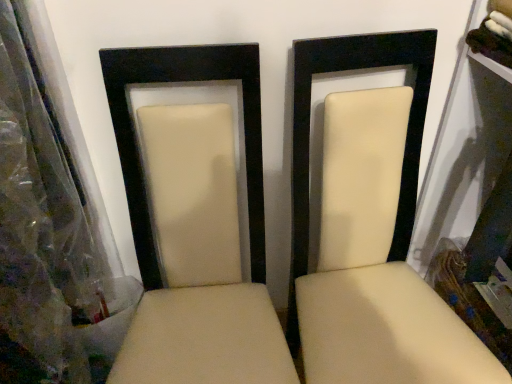
Find the location of a particular element. This screenshot has height=384, width=512. beige leather chair at center, positioned as the second chair in left-to-right order is located at coordinates [x=370, y=230].

How much space does beige leather chair at center, which ranks as the 1th chair in right-to-left order, occupy vertically?

It is 3.52 feet.

This screenshot has height=384, width=512. What do you see at coordinates (370, 230) in the screenshot? I see `beige leather chair at center, which ranks as the 1th chair in right-to-left order` at bounding box center [370, 230].

This screenshot has width=512, height=384. In order to click on beige leather chair at center, which is the second chair from right to left in this screenshot , I will do `click(194, 225)`.

What is the approximate width of beige leather chair at center, which is the second chair from right to left?

It is 22.85 inches.

What do you see at coordinates (194, 225) in the screenshot? This screenshot has height=384, width=512. I see `beige leather chair at center, which is the second chair from right to left` at bounding box center [194, 225].

Find the location of `beige leather chair at center, positioned as the second chair in left-to-right order`. beige leather chair at center, positioned as the second chair in left-to-right order is located at coordinates (370, 230).

Can you confirm if beige leather chair at center, marked as the 1th chair in a left-to-right arrangement, is positioned to the left of beige leather chair at center, positioned as the second chair in left-to-right order?

Indeed, beige leather chair at center, marked as the 1th chair in a left-to-right arrangement, is positioned on the left side of beige leather chair at center, positioned as the second chair in left-to-right order.

Does beige leather chair at center, marked as the 1th chair in a left-to-right arrangement, lie behind beige leather chair at center, positioned as the second chair in left-to-right order?

No, beige leather chair at center, marked as the 1th chair in a left-to-right arrangement, is closer to the camera.

Between point (148, 233) and point (371, 297), which one is positioned behind?

Point (371, 297)

From the image's perspective, which is above, beige leather chair at center, which is the second chair from right to left, or beige leather chair at center, which ranks as the 1th chair in right-to-left order?

beige leather chair at center, which ranks as the 1th chair in right-to-left order.

From a real-world perspective, is beige leather chair at center, marked as the 1th chair in a left-to-right arrangement, positioned over beige leather chair at center, which ranks as the 1th chair in right-to-left order, based on gravity?

No, from a real-world perspective, beige leather chair at center, marked as the 1th chair in a left-to-right arrangement, is not on top of beige leather chair at center, which ranks as the 1th chair in right-to-left order.

Based on the photo, is beige leather chair at center, marked as the 1th chair in a left-to-right arrangement, wider than beige leather chair at center, positioned as the second chair in left-to-right order?

Yes.

In terms of height, does beige leather chair at center, which is the second chair from right to left, look taller or shorter compared to beige leather chair at center, positioned as the second chair in left-to-right order?

Clearly, beige leather chair at center, which is the second chair from right to left, is shorter compared to beige leather chair at center, positioned as the second chair in left-to-right order.

Considering the sizes of objects beige leather chair at center, which is the second chair from right to left, and beige leather chair at center, positioned as the second chair in left-to-right order, in the image provided, who is smaller, beige leather chair at center, which is the second chair from right to left, or beige leather chair at center, positioned as the second chair in left-to-right order,?

beige leather chair at center, which is the second chair from right to left.

Is beige leather chair at center, marked as the 1th chair in a left-to-right arrangement, situated inside beige leather chair at center, which ranks as the 1th chair in right-to-left order, or outside?

beige leather chair at center, marked as the 1th chair in a left-to-right arrangement, is not inside beige leather chair at center, which ranks as the 1th chair in right-to-left order, it's outside.

Is beige leather chair at center, which is the second chair from right to left, far away from beige leather chair at center, positioned as the second chair in left-to-right order?

They are positioned close to each other.

Does beige leather chair at center, which is the second chair from right to left, turn towards beige leather chair at center, positioned as the second chair in left-to-right order?

No, beige leather chair at center, which is the second chair from right to left, is not facing towards beige leather chair at center, positioned as the second chair in left-to-right order.

At what (x,y) coordinates should I click in order to perform the action: click on chair to the left of beige leather chair at center, positioned as the second chair in left-to-right order. Please return your answer as a coordinate pair (x, y). Looking at the image, I should click on (194, 225).

Which is more to the left, beige leather chair at center, positioned as the second chair in left-to-right order, or beige leather chair at center, marked as the 1th chair in a left-to-right arrangement?

From the viewer's perspective, beige leather chair at center, marked as the 1th chair in a left-to-right arrangement, appears more on the left side.

Which is behind, beige leather chair at center, which ranks as the 1th chair in right-to-left order, or beige leather chair at center, marked as the 1th chair in a left-to-right arrangement?

beige leather chair at center, which ranks as the 1th chair in right-to-left order, is more distant.

Considering the positions of point (390, 305) and point (209, 119), is point (390, 305) closer or farther from the camera than point (209, 119)?

Point (390, 305) is positioned farther from the camera compared to point (209, 119).

From the image's perspective, is beige leather chair at center, which ranks as the 1th chair in right-to-left order, positioned above or below beige leather chair at center, marked as the 1th chair in a left-to-right arrangement?

From the image's perspective, beige leather chair at center, which ranks as the 1th chair in right-to-left order, appears above beige leather chair at center, marked as the 1th chair in a left-to-right arrangement.

From a real-world perspective, which is physically below, beige leather chair at center, positioned as the second chair in left-to-right order, or beige leather chair at center, marked as the 1th chair in a left-to-right arrangement?

beige leather chair at center, marked as the 1th chair in a left-to-right arrangement, from a real-world perspective.

Is beige leather chair at center, which ranks as the 1th chair in right-to-left order, thinner than beige leather chair at center, which is the second chair from right to left?

Yes.

Between beige leather chair at center, positioned as the second chair in left-to-right order, and beige leather chair at center, which is the second chair from right to left, which one has more height?

beige leather chair at center, positioned as the second chair in left-to-right order, is taller.

Considering the sizes of objects beige leather chair at center, which ranks as the 1th chair in right-to-left order, and beige leather chair at center, marked as the 1th chair in a left-to-right arrangement, in the image provided, who is smaller, beige leather chair at center, which ranks as the 1th chair in right-to-left order, or beige leather chair at center, marked as the 1th chair in a left-to-right arrangement,?

beige leather chair at center, marked as the 1th chair in a left-to-right arrangement.

Is beige leather chair at center, which ranks as the 1th chair in right-to-left order, situated inside beige leather chair at center, marked as the 1th chair in a left-to-right arrangement, or outside?

beige leather chair at center, which ranks as the 1th chair in right-to-left order, exists outside the volume of beige leather chair at center, marked as the 1th chair in a left-to-right arrangement.

Is beige leather chair at center, which ranks as the 1th chair in right-to-left order, far from beige leather chair at center, which is the second chair from right to left?

That's not correct — beige leather chair at center, which ranks as the 1th chair in right-to-left order, is a little close to beige leather chair at center, which is the second chair from right to left.

Is beige leather chair at center, which ranks as the 1th chair in right-to-left order, turned away from beige leather chair at center, which is the second chair from right to left?

beige leather chair at center, which ranks as the 1th chair in right-to-left order, does not have its back to beige leather chair at center, which is the second chair from right to left.

How different are the orientations of beige leather chair at center, positioned as the second chair in left-to-right order, and beige leather chair at center, marked as the 1th chair in a left-to-right arrangement, in degrees?

beige leather chair at center, positioned as the second chair in left-to-right order, and beige leather chair at center, marked as the 1th chair in a left-to-right arrangement, are facing 3.35 degrees away from each other.

Locate an element on the screen. This screenshot has width=512, height=384. chair that is behind the beige leather chair at center, which is the second chair from right to left is located at coordinates coord(370,230).

This screenshot has width=512, height=384. I want to click on chair lying below the beige leather chair at center, which ranks as the 1th chair in right-to-left order (from the image's perspective), so click(x=194, y=225).

Image resolution: width=512 pixels, height=384 pixels. I want to click on chair that appears below the beige leather chair at center, positioned as the second chair in left-to-right order (from a real-world perspective), so click(194, 225).